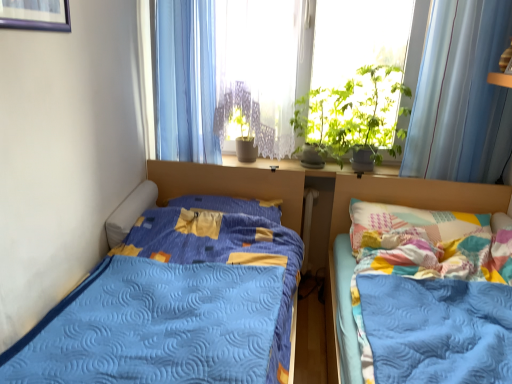
This screenshot has width=512, height=384. What do you see at coordinates (211, 189) in the screenshot? I see `blue quilted bed at left, which ranks as the first bed in left-to-right order` at bounding box center [211, 189].

What are the coordinates of `translucent fabric at center` in the screenshot? It's located at (304, 43).

What do you see at coordinates (186, 81) in the screenshot? This screenshot has height=384, width=512. I see `blue sheer curtain at upper center, the 1th curtain when ordered from left to right` at bounding box center [186, 81].

In order to face blue sheer curtain at upper center, the 1th curtain when ordered from left to right, should I rotate leftwards or rightwards?

A 8.698 degree turn to the left will do.

Measure the distance between patchwork quilted bed at right, the second bed when ordered from left to right, and camera.

5.70 feet.

I want to click on light blue sheer curtain at upper right, the 2th curtain positioned from the left, so [461, 95].

This screenshot has width=512, height=384. I want to click on blue quilted bed at left, which ranks as the first bed in left-to-right order, so click(x=211, y=189).

Based on the photo, is white lace curtain at center not inside light blue sheer curtain at upper right, which ranks as the 1th curtain in right-to-left order?

white lace curtain at center lies outside light blue sheer curtain at upper right, which ranks as the 1th curtain in right-to-left order,'s area.

Can you confirm if white lace curtain at center is positioned to the left of light blue sheer curtain at upper right, the 2th curtain positioned from the left?

Yes, white lace curtain at center is to the left of light blue sheer curtain at upper right, the 2th curtain positioned from the left.

Is white lace curtain at center next to light blue sheer curtain at upper right, which ranks as the 1th curtain in right-to-left order, and touching it?

white lace curtain at center is not next to light blue sheer curtain at upper right, which ranks as the 1th curtain in right-to-left order, and they're not touching.

Consider the image. Considering the sizes of objects white lace curtain at center and light blue sheer curtain at upper right, which ranks as the 1th curtain in right-to-left order, in the image provided, who is wider, white lace curtain at center or light blue sheer curtain at upper right, which ranks as the 1th curtain in right-to-left order,?

white lace curtain at center.

From a real-world perspective, is white plastic radiator at center under blue quilted bed at left, which is counted as the 2th bed, starting from the right?

Yes.

Does white plastic radiator at center have a greater width compared to blue quilted bed at left, which is counted as the 2th bed, starting from the right?

In fact, white plastic radiator at center might be narrower than blue quilted bed at left, which is counted as the 2th bed, starting from the right.

Is blue quilted bed at left, which is counted as the 2th bed, starting from the right, inside white plastic radiator at center?

No, white plastic radiator at center does not contain blue quilted bed at left, which is counted as the 2th bed, starting from the right.

Does white plastic radiator at center have a lesser height compared to blue quilted bed at left, which ranks as the first bed in left-to-right order?

Yes, white plastic radiator at center is shorter than blue quilted bed at left, which ranks as the first bed in left-to-right order.

Consider the image. From the image's perspective, would you say white lace curtain at center is shown under patchwork quilted bed at right, the second bed when ordered from left to right?

Incorrect, from the image's perspective, white lace curtain at center is higher than patchwork quilted bed at right, the second bed when ordered from left to right.

Consider the image. From a real-world perspective, is white lace curtain at center on patchwork quilted bed at right, the second bed when ordered from left to right?

Yes, from a real-world perspective, white lace curtain at center is over patchwork quilted bed at right, the second bed when ordered from left to right

Between white lace curtain at center and patchwork quilted bed at right, the second bed when ordered from left to right, which one has smaller width?

white lace curtain at center.

Is white lace curtain at center not inside patchwork quilted bed at right, the second bed when ordered from left to right?

white lace curtain at center is positioned outside patchwork quilted bed at right, the second bed when ordered from left to right.

At what (x,y) coordinates should I click in order to perform the action: click on curtain on the left of the green leafy plant at upper center. Please return your answer as a coordinate pair (x, y). The image size is (512, 384). Looking at the image, I should click on tap(186, 81).

From the image's perspective, who appears lower, green leafy plant at upper center or blue sheer curtain at upper center, the second curtain in the right-to-left sequence?

green leafy plant at upper center is shown below in the image.

Are green leafy plant at upper center and blue sheer curtain at upper center, the 1th curtain when ordered from left to right, making contact?

No.

From a real-world perspective, is green leafy plant at upper center above or below blue sheer curtain at upper center, the second curtain in the right-to-left sequence?

green leafy plant at upper center is below blue sheer curtain at upper center, the second curtain in the right-to-left sequence.

Which point is more forward, (294, 169) or (328, 145)?

The point (294, 169) is more forward.

From the image's perspective, is blue quilted bed at left, which is counted as the 2th bed, starting from the right, under green leafy plant at upper center?

Yes.

Is blue quilted bed at left, which is counted as the 2th bed, starting from the right, outside of green leafy plant at upper center?

Yes, blue quilted bed at left, which is counted as the 2th bed, starting from the right, is outside of green leafy plant at upper center.

Is blue quilted bed at left, which ranks as the first bed in left-to-right order, taller than green leafy plant at upper center?

Indeed, blue quilted bed at left, which ranks as the first bed in left-to-right order, has a greater height compared to green leafy plant at upper center.

Does point (424, 29) come closer to viewer compared to point (289, 9)?

Yes.

Is white lace curtain at center surrounded by translucent fabric at center?

Yes, white lace curtain at center is a part of translucent fabric at center.

From the picture: What's the angular difference between translucent fabric at center and white lace curtain at center's facing directions?

translucent fabric at center and white lace curtain at center are facing 1.19 degrees away from each other.

From a real-world perspective, who is located lower, translucent fabric at center or white lace curtain at center?

white lace curtain at center is physically lower.

Which of these two, blue quilted bed at left, which is counted as the 2th bed, starting from the right, or blue sheer curtain at upper center, the 1th curtain when ordered from left to right, is bigger?

With larger size is blue quilted bed at left, which is counted as the 2th bed, starting from the right.

Is blue quilted bed at left, which is counted as the 2th bed, starting from the right, next to blue sheer curtain at upper center, the second curtain in the right-to-left sequence, and touching it?

No, blue quilted bed at left, which is counted as the 2th bed, starting from the right, is not with blue sheer curtain at upper center, the second curtain in the right-to-left sequence.

Does blue quilted bed at left, which ranks as the first bed in left-to-right order, have a lesser height compared to blue sheer curtain at upper center, the second curtain in the right-to-left sequence?

Correct, blue quilted bed at left, which ranks as the first bed in left-to-right order, is not as tall as blue sheer curtain at upper center, the second curtain in the right-to-left sequence.

From the image's perspective, would you say blue quilted bed at left, which is counted as the 2th bed, starting from the right, is positioned over blue sheer curtain at upper center, the second curtain in the right-to-left sequence?

No.

The width and height of the screenshot is (512, 384). Identify the location of curtain lying on the right of white lace curtain at center. (461, 95).

The image size is (512, 384). What are the coordinates of `radiator that appears above the blue quilted bed at left, which ranks as the first bed in left-to-right order (from the image's perspective)` in the screenshot? It's located at (307, 224).

Looking at the image, which one is located further to white plastic radiator at center, blue sheer curtain at upper center, the second curtain in the right-to-left sequence, or white lace curtain at center?

The object further to white plastic radiator at center is blue sheer curtain at upper center, the second curtain in the right-to-left sequence.

When comparing their distances from blue sheer curtain at upper center, the 1th curtain when ordered from left to right, does blue quilted bed at left, which is counted as the 2th bed, starting from the right, or white lace curtain at center seem closer?

white lace curtain at center lies closer to blue sheer curtain at upper center, the 1th curtain when ordered from left to right, than the other object.

Which object lies nearer to the anchor point green leafy plant at upper center, blue quilted bed at left, which is counted as the 2th bed, starting from the right, or translucent fabric at center?

Among the two, translucent fabric at center is located nearer to green leafy plant at upper center.

Which object lies further to the anchor point translucent fabric at center, blue sheer curtain at upper center, the second curtain in the right-to-left sequence, or blue quilted bed at left, which is counted as the 2th bed, starting from the right?

The object further to translucent fabric at center is blue quilted bed at left, which is counted as the 2th bed, starting from the right.

Which object lies nearer to the anchor point translucent fabric at center, green leafy plant at upper center or blue quilted bed at left, which ranks as the first bed in left-to-right order?

green leafy plant at upper center is closer to translucent fabric at center.

From the picture: Estimate the real-world distances between objects in this image. Which object is further from translucent fabric at center, green leafy plant at upper center or patchwork quilted bed at right, the first bed positioned from the right?

Among the two, patchwork quilted bed at right, the first bed positioned from the right, is located further to translucent fabric at center.

When comparing their distances from white lace curtain at center, does blue sheer curtain at upper center, the second curtain in the right-to-left sequence, or translucent fabric at center seem closer?

translucent fabric at center.

Based on their spatial positions, is white plastic radiator at center or green leafy plant at upper center closer to white lace curtain at center?

The object closer to white lace curtain at center is green leafy plant at upper center.

I want to click on vegetation positioned between patchwork quilted bed at right, the first bed positioned from the right, and white plastic radiator at center from near to far, so click(x=353, y=114).

The image size is (512, 384). Find the location of `window screen located between blue sheer curtain at upper center, the second curtain in the right-to-left sequence, and light blue sheer curtain at upper right, which ranks as the 1th curtain in right-to-left order, in the left-right direction`. window screen located between blue sheer curtain at upper center, the second curtain in the right-to-left sequence, and light blue sheer curtain at upper right, which ranks as the 1th curtain in right-to-left order, in the left-right direction is located at coordinates (257, 71).

Where is `bed between blue quilted bed at left, which is counted as the 2th bed, starting from the right, and light blue sheer curtain at upper right, the 2th curtain positioned from the left, from left to right`? The width and height of the screenshot is (512, 384). bed between blue quilted bed at left, which is counted as the 2th bed, starting from the right, and light blue sheer curtain at upper right, the 2th curtain positioned from the left, from left to right is located at coordinates (396, 204).

You are a GUI agent. You are given a task and a screenshot of the screen. Output one action in this format:
    pyautogui.click(x=<x>, y=<y>)
    Task: Click on the vegetation that lies between white lace curtain at center and white plastic radiator at center from top to bottom
    
    Given the screenshot: What is the action you would take?
    pyautogui.click(x=353, y=114)